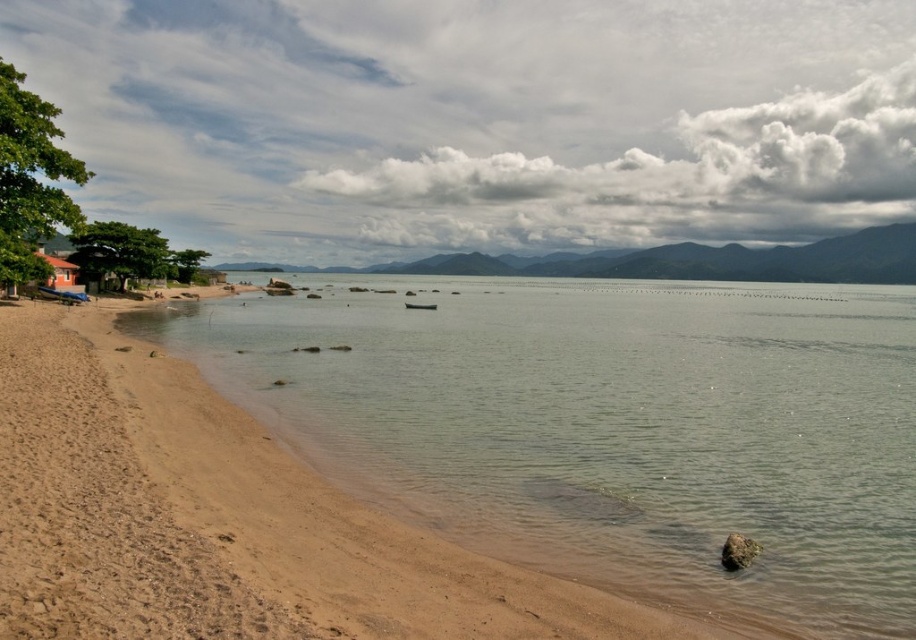
Question: In this image, where is clear water at beach left located relative to brown wooden hut at lower left?

Choices:
 (A) right
 (B) left

Answer: (A)

Question: Can you confirm if clear water at beach left is thinner than brown wooden hut at lower left?

Choices:
 (A) no
 (B) yes

Answer: (A)

Question: Which point is farther to the camera?

Choices:
 (A) (821, 364)
 (B) (50, 253)

Answer: (B)

Question: Can you confirm if clear water at beach left is positioned below brown wooden hut at lower left?

Choices:
 (A) yes
 (B) no

Answer: (A)

Question: Which point is farther to the camera?

Choices:
 (A) clear water at beach left
 (B) brown wooden hut at lower left

Answer: (B)